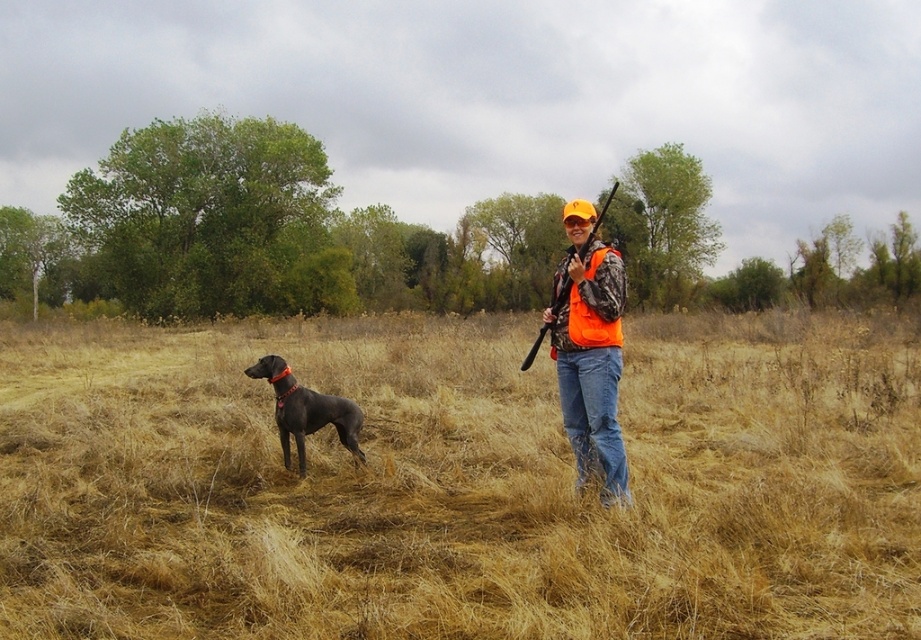
What are the coordinates of the orange camo vest at center?

The orange camo vest at center is located at point (590, 358).

You are a hiker who has just spotted a hunter in the distance. You see the orange camo vest at center represented by point [590,358]. Is the hunter wearing a safety vest?

Yes, the orange camo vest at center represented by point [590,358] indicates the hunter is wearing a safety vest.

You are a hunter in the field. You see the dry grass at center and the matte black rifle at center. Which object is closer to you?

The dry grass at center is closer to the viewer than the matte black rifle at center.